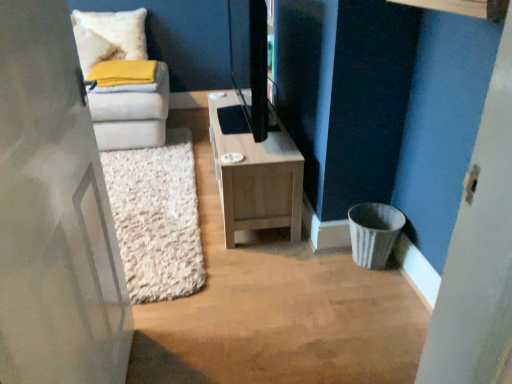
Question: Is light wood/texture tv stand at center smaller than white soft pillow at upper left?

Choices:
 (A) yes
 (B) no

Answer: (B)

Question: From a real-world perspective, is light wood/texture tv stand at center over white soft pillow at upper left?

Choices:
 (A) yes
 (B) no

Answer: (B)

Question: Is white soft pillow at upper left located within light wood/texture tv stand at center?

Choices:
 (A) yes
 (B) no

Answer: (B)

Question: Is light wood/texture tv stand at center shorter than white soft pillow at upper left?

Choices:
 (A) yes
 (B) no

Answer: (B)

Question: Would you say light wood/texture tv stand at center is outside white soft pillow at upper left?

Choices:
 (A) yes
 (B) no

Answer: (A)

Question: Does light wood/texture tv stand at center come in front of white soft pillow at upper left?

Choices:
 (A) no
 (B) yes

Answer: (B)

Question: Can you confirm if white soft pillow at upper left is taller than white matte door at left?

Choices:
 (A) no
 (B) yes

Answer: (A)

Question: Does white soft pillow at upper left lie in front of white matte door at left?

Choices:
 (A) no
 (B) yes

Answer: (A)

Question: Does white soft pillow at upper left appear on the right side of white matte door at left?

Choices:
 (A) no
 (B) yes

Answer: (A)

Question: Can you confirm if white soft pillow at upper left is shorter than white matte door at left?

Choices:
 (A) yes
 (B) no

Answer: (A)

Question: Is white soft pillow at upper left oriented away from white matte door at left?

Choices:
 (A) no
 (B) yes

Answer: (A)

Question: From the image's perspective, would you say white soft pillow at upper left is shown under white matte door at left?

Choices:
 (A) yes
 (B) no

Answer: (B)

Question: Is white soft pillow at upper left at the left side of light wood/texture tv stand at center?

Choices:
 (A) yes
 (B) no

Answer: (A)